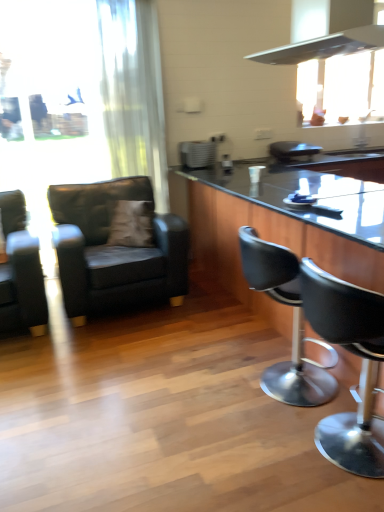
At what (x,y) coordinates should I click in order to perform the action: click on vacant space in front of black leather bar stool at center, the third chair from the left. Please return your answer as a coordinate pair (x, y). Looking at the image, I should click on (250, 461).